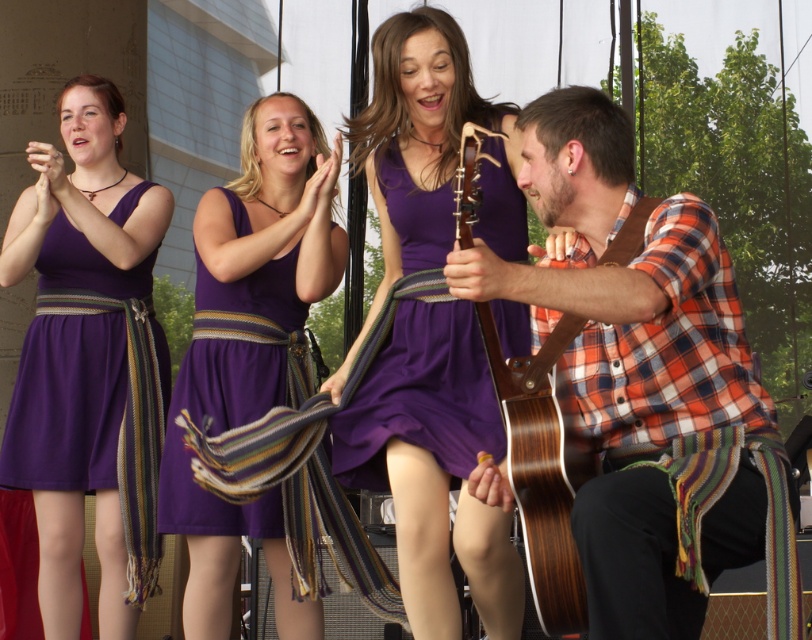
You are an audience member sitting in the front row. You notice the plaid shirt at right and the purple matte dress at center. Which one is positioned more to the right side of the scene?

The plaid shirt at right is positioned more to the right side of the scene than the purple matte dress at center.

You are standing in the audience watching the performance. Which performer is closer to you, the plaid shirt at right or the purple matte dress at left?

The plaid shirt at right is closer to the viewer than the purple matte dress at left.

You are a photographer standing in front of the performance scene. You want to take a photo that includes both the plaid shirt at right and the purple matte dress at center. Which object will appear larger in the photo?

The plaid shirt at right will appear larger in the photo because it is closer to the viewer than the purple matte dress at center.